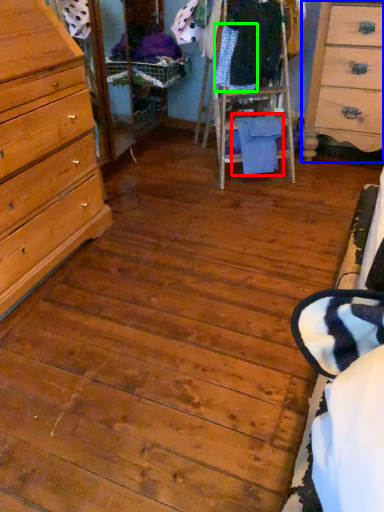
Question: Based on their relative distances, which object is farther from clothing (highlighted by a red box)? Choose from chest of drawers (highlighted by a blue box) and clothing (highlighted by a green box).

Choices:
 (A) chest of drawers
 (B) clothing

Answer: (A)